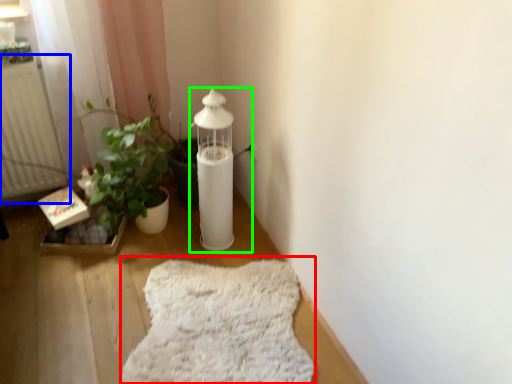
Question: Based on their relative distances, which object is farther from blanket (highlighted by a red box)? Choose from radiator (highlighted by a blue box) and oil lamp (highlighted by a green box).

Choices:
 (A) radiator
 (B) oil lamp

Answer: (A)